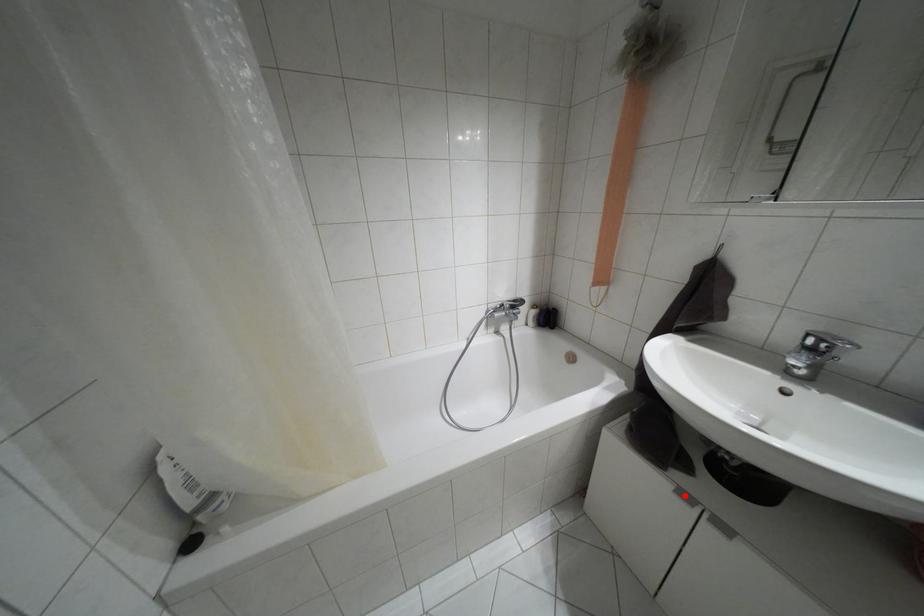
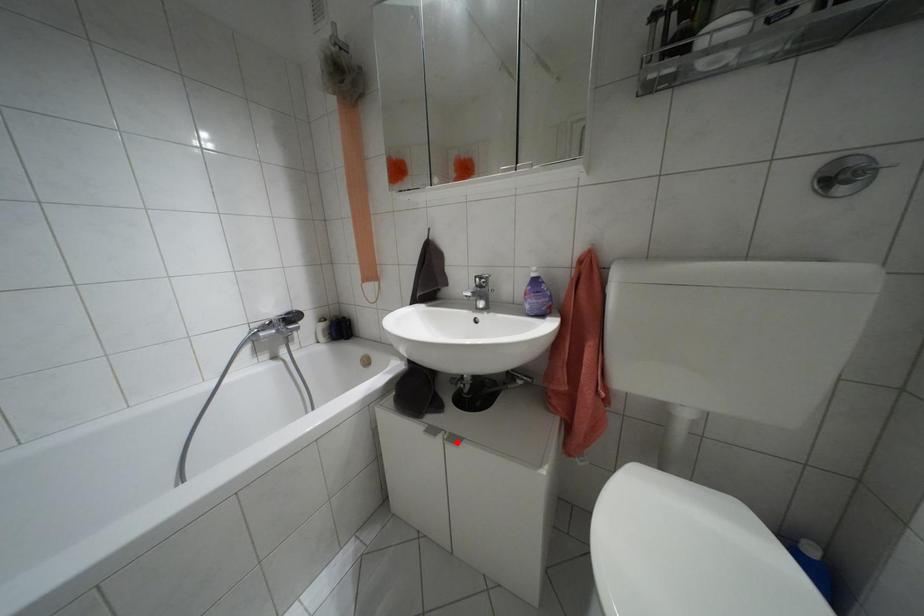
I am providing you with two images of the same scene from different viewpoints. A red point is marked on the first image and another point is marked on the second image. Does the point marked in image1 correspond to the same location as the one in image2?

No